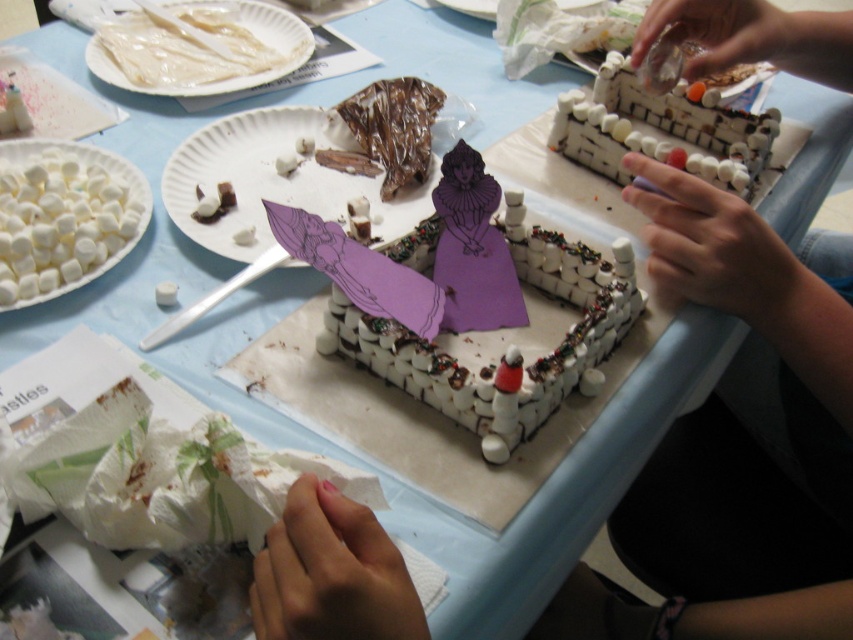
Which is behind, point (402, 336) or point (73, 227)?

Point (73, 227)

Looking at this image, is purple paper cutout at center bigger than white marshmallows at left?

Yes.

Which is in front, point (451, 193) or point (19, 156)?

Point (451, 193) is more forward.

Locate an element on the screen. purple paper cutout at center is located at coordinates (490, 308).

Who is positioned more to the left, purple paper cutout at center or white paper plate at center?

From the viewer's perspective, white paper plate at center appears more on the left side.

At what (x,y) coordinates should I click in order to perform the action: click on purple paper cutout at center. Please return your answer as a coordinate pair (x, y). The height and width of the screenshot is (640, 853). Looking at the image, I should click on (490, 308).

Is purple paper cutout at center smaller than white paper plate at upper left?

No, purple paper cutout at center is not smaller than white paper plate at upper left.

Who is more forward, (392, 355) or (122, 32)?

Positioned in front is point (392, 355).

Does point (595, 342) come behind point (225, 84)?

No, (595, 342) is in front of (225, 84).

Locate an element on the screen. The height and width of the screenshot is (640, 853). purple paper cutout at center is located at coordinates (490, 308).